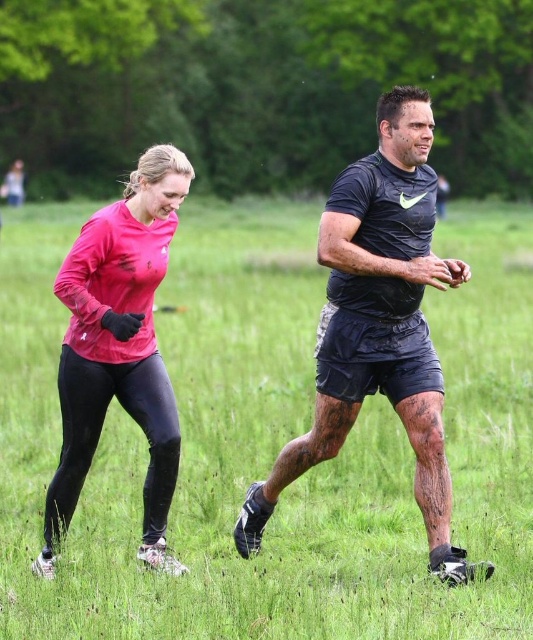
Based on the scene description, where is the pink fabric leggings located in relation to the point marked at coordinates (270, 442)?

The pink fabric leggings at left are located exactly at the point marked at coordinates (270, 442).

You are a photographer positioned at the back of the field. You want to capture a photo of the black matte shirt at center without the pink fabric leggings at left blocking the view. Is this possible based on their current positions?

The pink fabric leggings at left is in front of the black matte shirt at center, so it would block the view. To capture the black matte shirt at center without obstruction, you would need to adjust your angle or have the participants move positions.